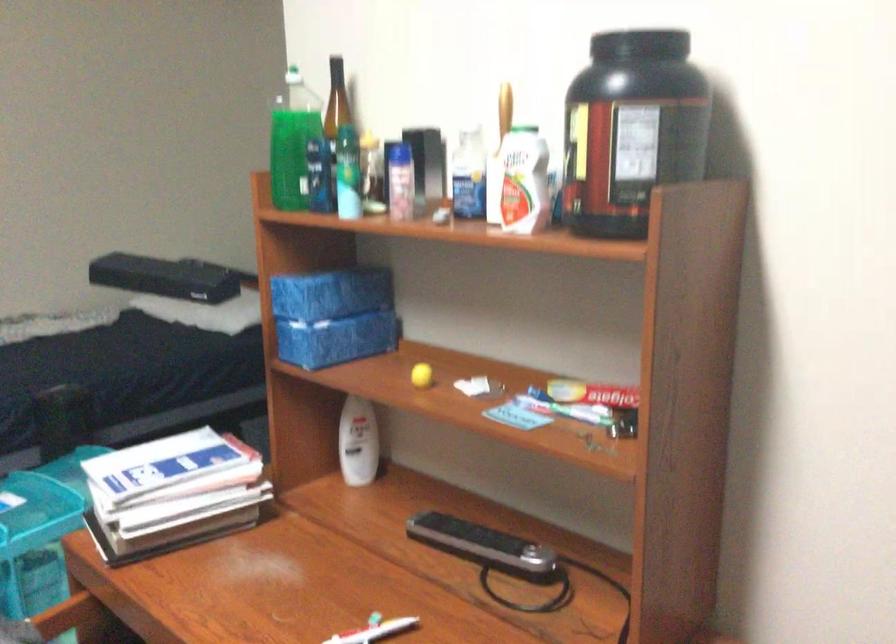
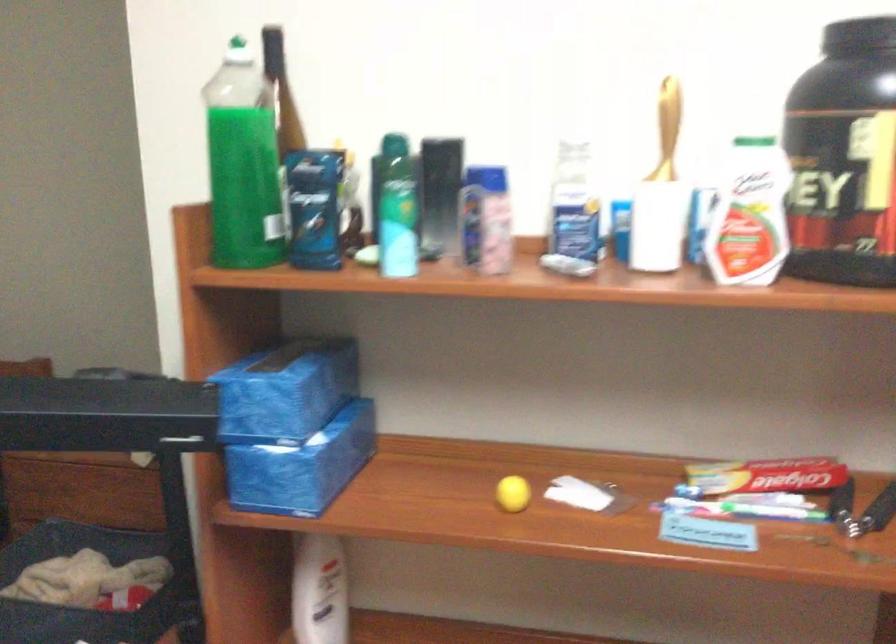
Locate, in the second image, the point that corresponds to point (316, 173) in the first image.

(314, 207)